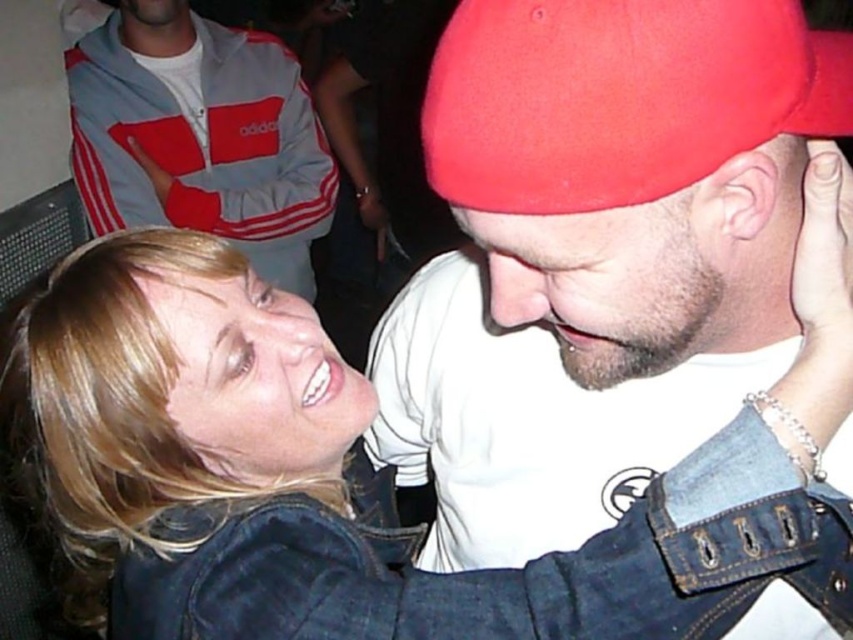
From the picture: You are a photographer standing in front of the beige matte skin at center. You want to take a clear photo of it. What is the minimum distance you need to maintain to ensure the photo is in focus?

The beige matte skin at center is 18.93 inches away from the viewer. To ensure the photo is in focus, you should maintain a distance of at least 18.93 inches.